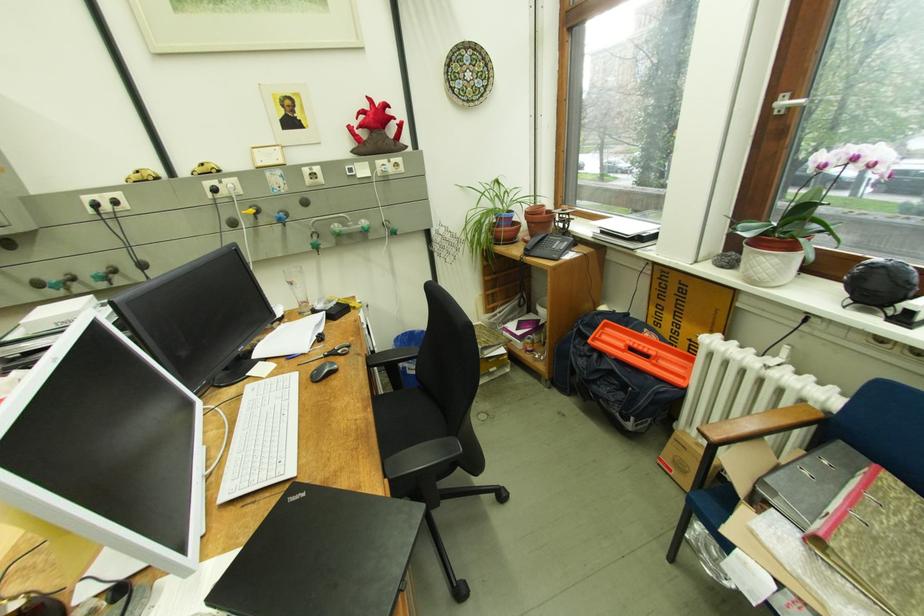
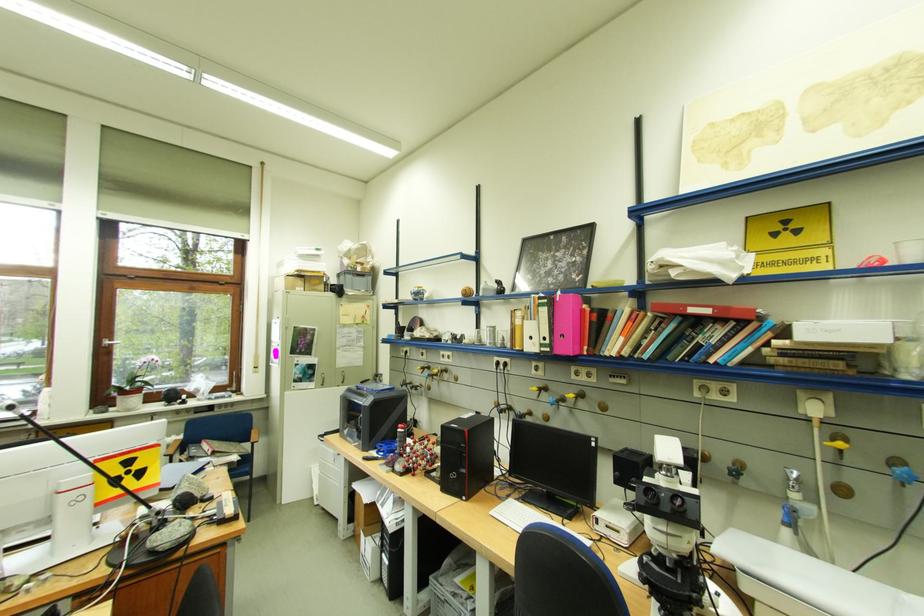
Locate, in the second image, the point that corresponds to point 794,103 in the first image.

(117, 342)